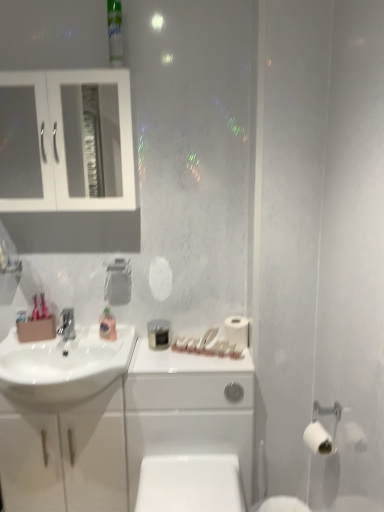
Locate an element on the screen. The image size is (384, 512). free space above white glossy toilet bowl at lower center (from a real-world perspective) is located at coordinates (192, 475).